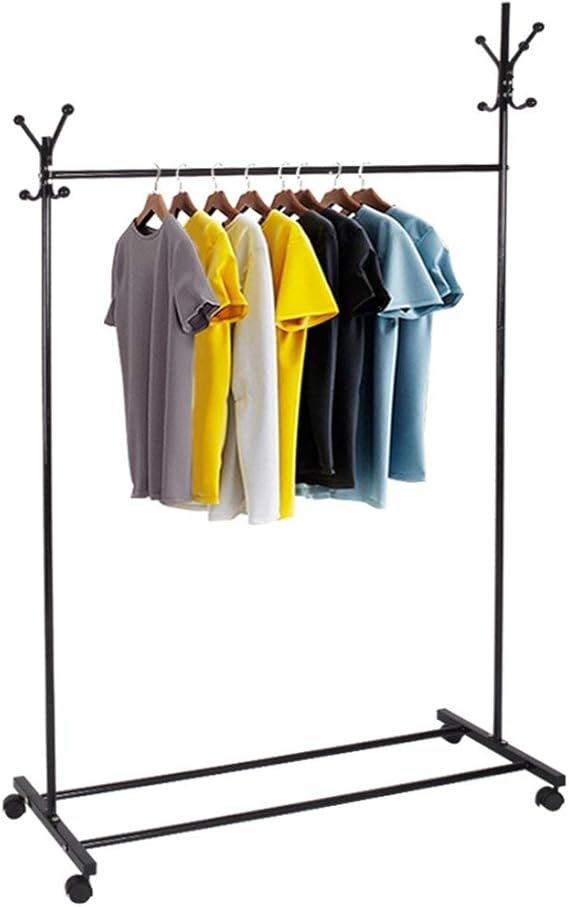
Find the location of a particular element. This screenshot has width=569, height=907. coat hook is located at coordinates (61, 194), (26, 194), (19, 122), (70, 110), (521, 44), (539, 26), (477, 38), (529, 98), (483, 109).